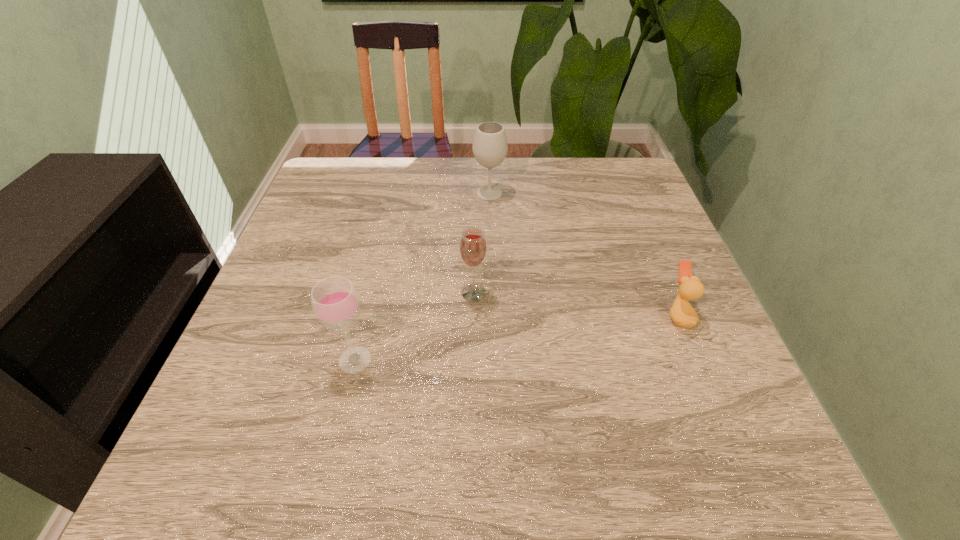
Find the location of a particular element. vacant space located 0.240m on the beak of the shortest object is located at coordinates (548, 315).

This screenshot has width=960, height=540. What are the coordinates of `free space located on the beak of the shortest object` in the screenshot? It's located at (573, 315).

Find the location of a particular element. The height and width of the screenshot is (540, 960). object that is at the far edge is located at coordinates (490, 147).

You are a GUI agent. You are given a task and a screenshot of the screen. Output one action in this format:
    pyautogui.click(x=<x>, y=<y>)
    Task: Click on the object that is at the right edge
    
    Given the screenshot: What is the action you would take?
    pyautogui.click(x=682, y=313)

What are the coordinates of `vacant space at the far edge of the desktop` in the screenshot? It's located at (512, 180).

Locate an element on the screen. vacant space at the near edge is located at coordinates (408, 443).

You are a GUI agent. You are given a task and a screenshot of the screen. Output one action in this format:
    pyautogui.click(x=<x>, y=<y>)
    Task: Click on the vacant region at the left edge of the desktop
    Image resolution: width=960 pixels, height=540 pixels.
    Given the screenshot: What is the action you would take?
    pyautogui.click(x=308, y=381)

In the image, there is a desktop. Where is `vacant space at the right edge`? The height and width of the screenshot is (540, 960). vacant space at the right edge is located at coordinates (742, 413).

Image resolution: width=960 pixels, height=540 pixels. In order to click on vacant space at the far left corner of the desktop in this screenshot , I will do `click(330, 163)`.

This screenshot has width=960, height=540. What are the coordinates of `vacant area that lies between the leftmost object and the duck` in the screenshot? It's located at (516, 338).